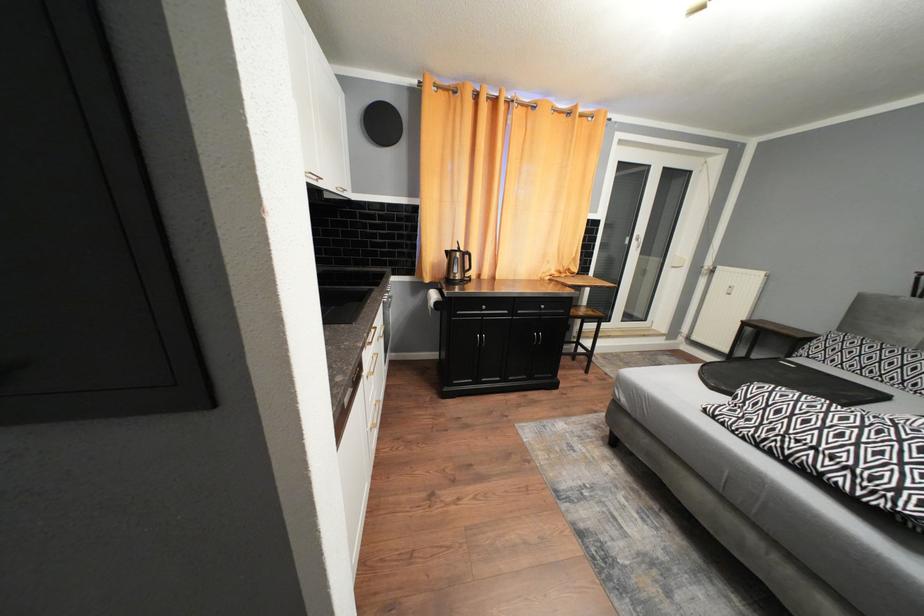
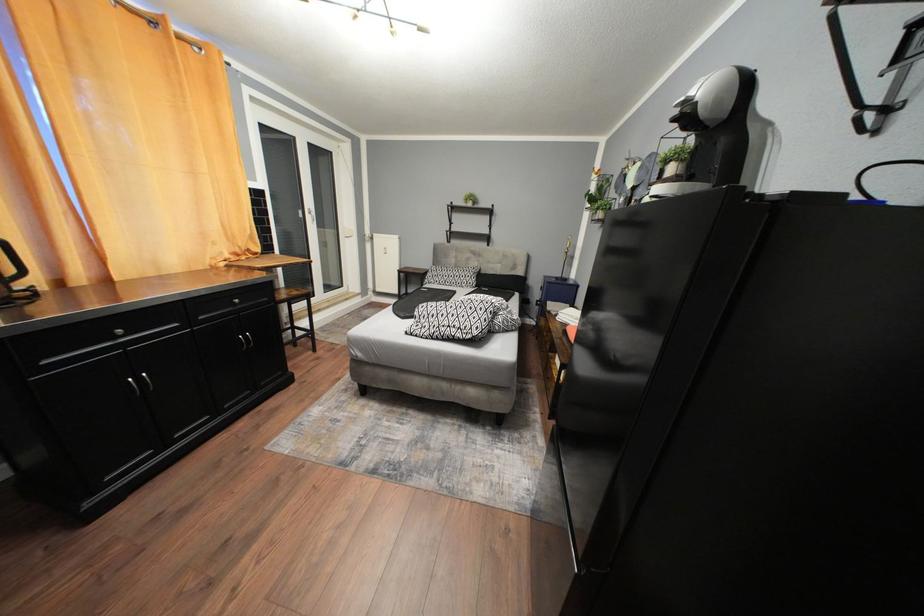
Question: Based on the continuous images, in which direction is the camera rotating? Reply with the corresponding letter.

Choices:
 (A) Left
 (B) Right
 (C) Up
 (D) Down

Answer: (B)